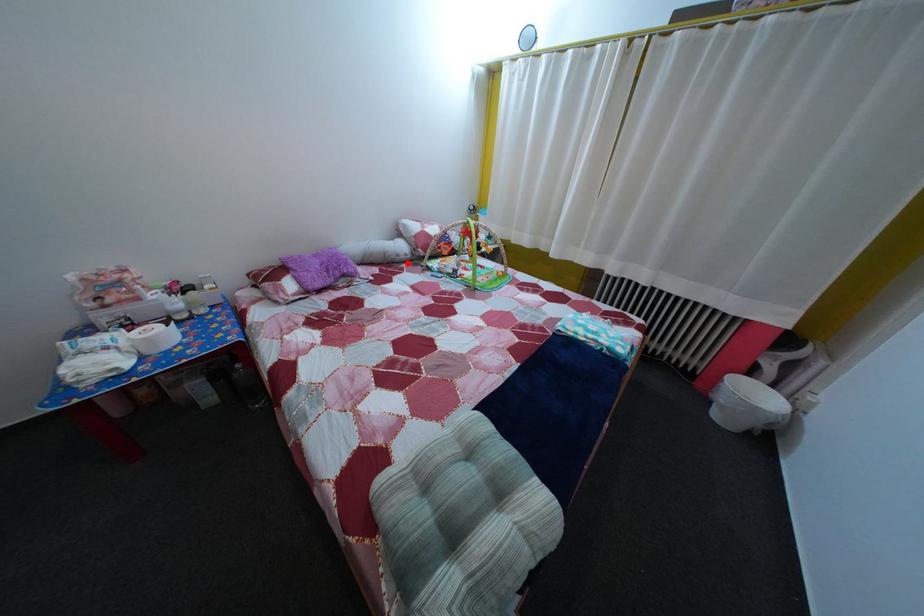
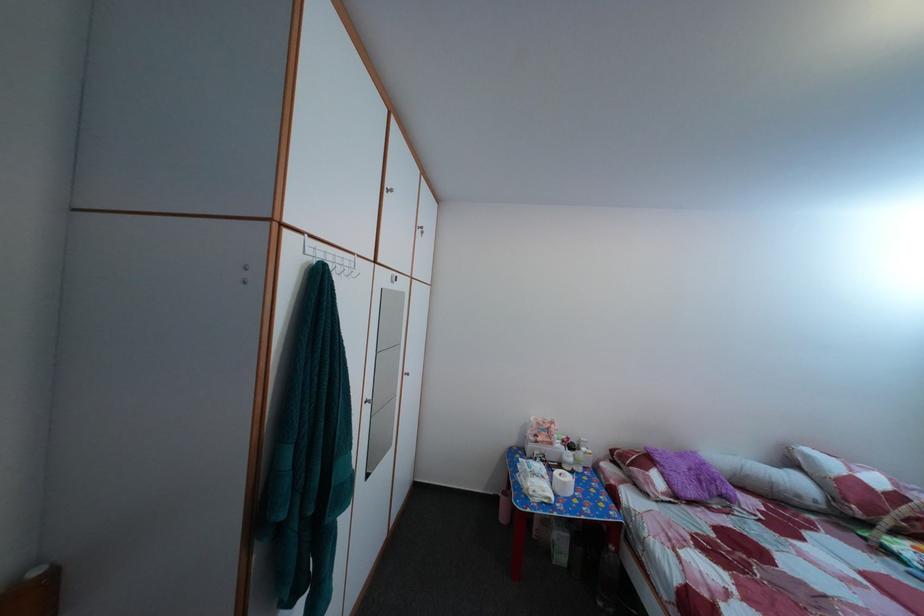
Where in the second image is the point corresponding to the highlighted location from the first image?

(808, 504)